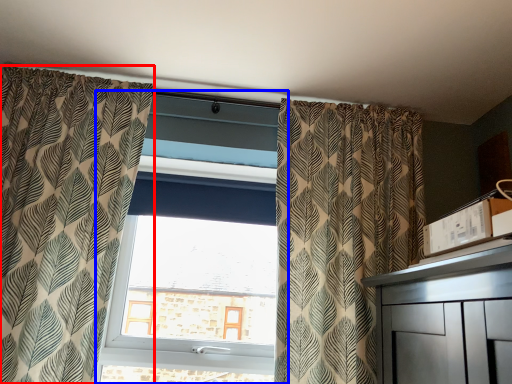
Question: Which point is further to the camera, curtain (highlighted by a red box) or window (highlighted by a blue box)?

Choices:
 (A) curtain
 (B) window

Answer: (B)